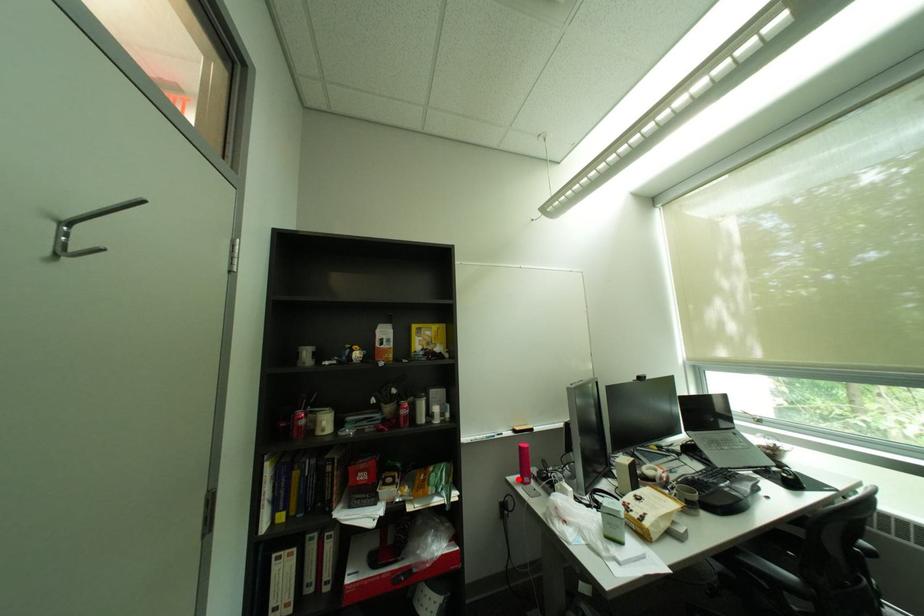
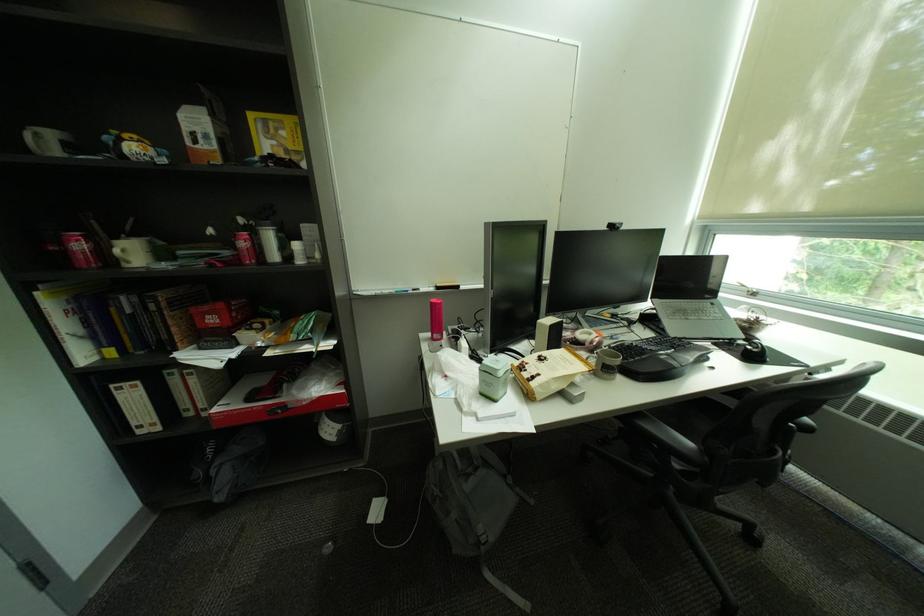
Where in the second image is the point corresponding to the highlighted location from the first image?

(431, 334)